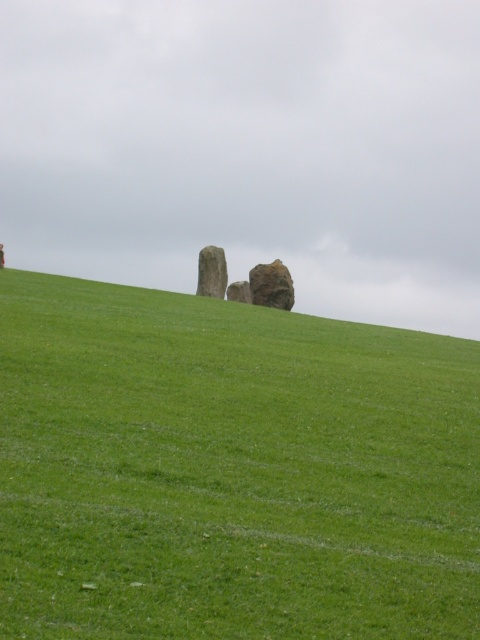
Is green grassy hill at center to the right of rough textured rock at center from the viewer's perspective?

Incorrect, green grassy hill at center is not on the right side of rough textured rock at center.

Looking at this image, does green grassy hill at center have a lesser width compared to rough textured rock at center?

Incorrect, green grassy hill at center's width is not less than rough textured rock at center's.

Which is in front, point (40, 518) or point (250, 284)?

Positioned in front is point (40, 518).

Locate an element on the screen. green grassy hill at center is located at coordinates (229, 468).

From the picture: Can you confirm if smooth gray stone at center is taller than smooth gray rock at center?

Correct, smooth gray stone at center is much taller as smooth gray rock at center.

Which is behind, point (216, 269) or point (245, 289)?

The point (216, 269) is more distant.

This screenshot has width=480, height=640. I want to click on smooth gray stone at center, so click(212, 273).

In the scene shown: Measure the distance between smooth gray rock at center and smooth stone statue at center.

14.04 meters

Can you confirm if smooth gray rock at center is positioned to the left of smooth stone statue at center?

In fact, smooth gray rock at center is to the right of smooth stone statue at center.

This screenshot has width=480, height=640. What do you see at coordinates (239, 291) in the screenshot?
I see `smooth gray rock at center` at bounding box center [239, 291].

Locate an element on the screen. The height and width of the screenshot is (640, 480). smooth gray rock at center is located at coordinates (239, 291).